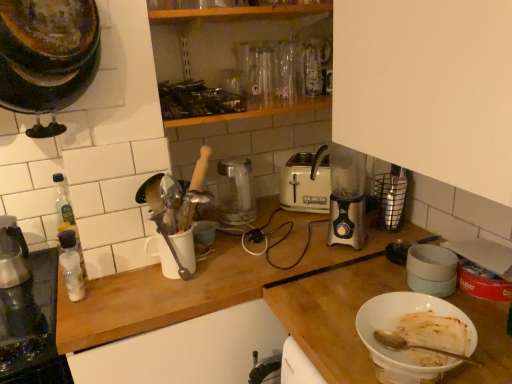
Where is `vacant space to the right of matte white cup at center, acting as the first bowl starting from the top`? The height and width of the screenshot is (384, 512). vacant space to the right of matte white cup at center, acting as the first bowl starting from the top is located at coordinates (244, 234).